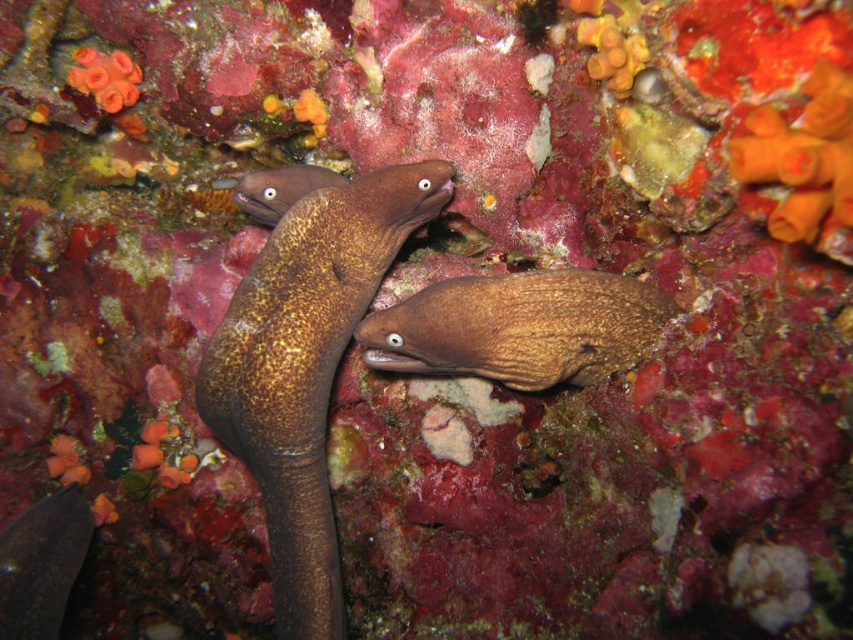
You are a marine biologist studying the two eels in the underwater scene. You need to place a 20 cm wide measurement tool between them. Which eel has a smaller width, the shiny brown eel at center or the brown textured eel at center?

The shiny brown eel at center has a smaller width than the brown textured eel at center according to the description.

You are an underwater photographer aiming to capture both the shiny brown eel at center and the brown textured eel at center in a single frame. Given their sizes, which eel should you focus on to ensure both fit comfortably in the photo?

The shiny brown eel at center is bigger than the brown textured eel at center, so you should focus on positioning the camera to accommodate the larger size of the shiny brown eel at center while still including the smaller brown textured eel at center in the frame.

You are a marine biologist diving in this underwater scene and want to collect a sample from the point at coordinates [285,460]. If your sampling tool has a maximum reach of 1 meter, will you be able to reach the point?

The distance between you and the point at coordinates [285,460] is 1.08 meters, which exceeds the sampling tool maximum reach of 1 meter. Therefore, you cannot reach the point with your current tool.